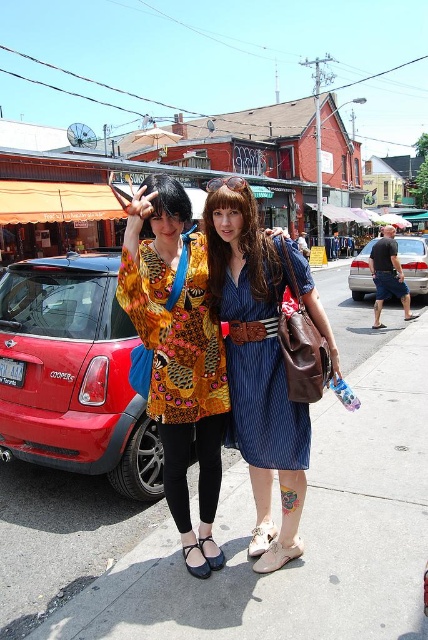
Based on the photo, you are standing in the street scene and want to find the point at coordinates (261, 346). Which object is this point located on?

The point at coordinates (261, 346) is located on the denim dress at center.

You are a photographer trying to capture a photo of the denim dress at center. The two people in the scene are standing 2.57 meters apart. If you want to ensure both individuals are in focus, what is the minimum distance you should set your camera lens to focus at?

The minimum focus distance should be set to 2.57 meters to ensure both individuals are in focus.